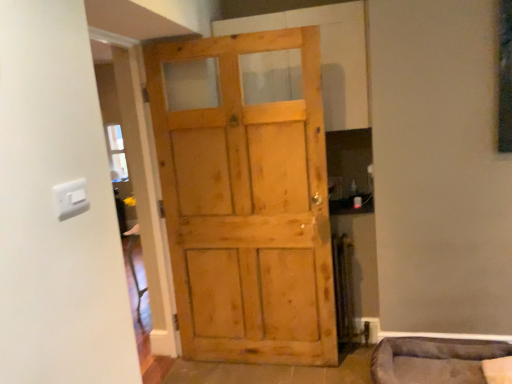
What do you see at coordinates (246, 206) in the screenshot? This screenshot has height=384, width=512. I see `light brown wooden door at center` at bounding box center [246, 206].

Locate an element on the screen. Image resolution: width=512 pixels, height=384 pixels. white plastic light switch at upper left is located at coordinates (71, 198).

In terms of width, does white plastic light switch at upper left look wider or thinner when compared to velvet grey pet bed at lower right?

Clearly, white plastic light switch at upper left has less width compared to velvet grey pet bed at lower right.

From a real-world perspective, relative to velvet grey pet bed at lower right, is white plastic light switch at upper left vertically above or below?

white plastic light switch at upper left is above velvet grey pet bed at lower right.

Considering their positions, is white plastic light switch at upper left located in front of or behind velvet grey pet bed at lower right?

white plastic light switch at upper left is in front of velvet grey pet bed at lower right.

Does velvet grey pet bed at lower right have a lesser width compared to light brown wooden door at center?

No, velvet grey pet bed at lower right is not thinner than light brown wooden door at center.

Considering the sizes of objects velvet grey pet bed at lower right and light brown wooden door at center in the image provided, who is shorter, velvet grey pet bed at lower right or light brown wooden door at center?

Standing shorter between the two is velvet grey pet bed at lower right.

From the image's perspective, would you say velvet grey pet bed at lower right is shown under light brown wooden door at center?

Indeed, from the image's perspective, velvet grey pet bed at lower right is shown beneath light brown wooden door at center.

Choose the correct answer: Is velvet grey pet bed at lower right inside light brown wooden door at center or outside it?

velvet grey pet bed at lower right cannot be found inside light brown wooden door at center.

Is white plastic light switch at upper left facing away from light brown wooden door at center?

No, white plastic light switch at upper left is not facing away from light brown wooden door at center.

Does white plastic light switch at upper left appear on the left side of light brown wooden door at center?

Yes, white plastic light switch at upper left is to the left of light brown wooden door at center.

From the image's perspective, who appears lower, white plastic light switch at upper left or light brown wooden door at center?

light brown wooden door at center.

Considering the relative sizes of white plastic light switch at upper left and light brown wooden door at center in the image provided, is white plastic light switch at upper left taller than light brown wooden door at center?

Incorrect, the height of white plastic light switch at upper left is not larger of that of light brown wooden door at center.

Is light brown wooden door at center taller than velvet grey pet bed at lower right?

Correct, light brown wooden door at center is much taller as velvet grey pet bed at lower right.

From a real-world perspective, is light brown wooden door at center located higher than velvet grey pet bed at lower right?

Yes, from a real-world perspective, light brown wooden door at center is on top of velvet grey pet bed at lower right.

Is light brown wooden door at center inside or outside of velvet grey pet bed at lower right?

light brown wooden door at center exists outside the volume of velvet grey pet bed at lower right.

Is light brown wooden door at center at the right side of velvet grey pet bed at lower right?

No.

Is light brown wooden door at center facing towards white plastic light switch at upper left?

Yes, light brown wooden door at center faces towards white plastic light switch at upper left.

Is point (329, 361) farther from camera compared to point (67, 211)?

Yes, it is behind point (67, 211).

From the image's perspective, which is above, light brown wooden door at center or white plastic light switch at upper left?

From the image's view, white plastic light switch at upper left is above.

In the scene shown: Considering the sizes of objects light brown wooden door at center and white plastic light switch at upper left in the image provided, who is taller, light brown wooden door at center or white plastic light switch at upper left?

Standing taller between the two is light brown wooden door at center.

Considering the relative sizes of velvet grey pet bed at lower right and white plastic light switch at upper left in the image provided, is velvet grey pet bed at lower right smaller than white plastic light switch at upper left?

No, velvet grey pet bed at lower right is not smaller than white plastic light switch at upper left.

In the scene shown: Looking at their sizes, would you say velvet grey pet bed at lower right is wider or thinner than white plastic light switch at upper left?

Clearly, velvet grey pet bed at lower right has more width compared to white plastic light switch at upper left.

Is velvet grey pet bed at lower right positioned far away from white plastic light switch at upper left?

Yes, velvet grey pet bed at lower right is far from white plastic light switch at upper left.

Does velvet grey pet bed at lower right have a lesser height compared to white plastic light switch at upper left?

Incorrect, the height of velvet grey pet bed at lower right does not fall short of that of white plastic light switch at upper left.

Find the location of a particular element. The image size is (512, 384). furniture that is under the white plastic light switch at upper left (from a real-world perspective) is located at coordinates (433, 360).

In order to click on furniture on the right of light brown wooden door at center in this screenshot , I will do `click(433, 360)`.

Based on their spatial positions, is light brown wooden door at center or white plastic light switch at upper left further from velvet grey pet bed at lower right?

Among the two, white plastic light switch at upper left is located further to velvet grey pet bed at lower right.

Estimate the real-world distances between objects in this image. Which object is further from white plastic light switch at upper left, velvet grey pet bed at lower right or light brown wooden door at center?

velvet grey pet bed at lower right lies further to white plastic light switch at upper left than the other object.

Considering their positions, is white plastic light switch at upper left positioned further to light brown wooden door at center than velvet grey pet bed at lower right?

Based on the image, white plastic light switch at upper left appears to be further to light brown wooden door at center.

Looking at the image, which one is located closer to light brown wooden door at center, velvet grey pet bed at lower right or white plastic light switch at upper left?

velvet grey pet bed at lower right is closer to light brown wooden door at center.

Estimate the real-world distances between objects in this image. Which object is further from white plastic light switch at upper left, light brown wooden door at center or velvet grey pet bed at lower right?

Among the two, velvet grey pet bed at lower right is located further to white plastic light switch at upper left.

Based on their spatial positions, is white plastic light switch at upper left or light brown wooden door at center further from velvet grey pet bed at lower right?

The object further to velvet grey pet bed at lower right is white plastic light switch at upper left.

The width and height of the screenshot is (512, 384). Identify the location of door between white plastic light switch at upper left and velvet grey pet bed at lower right from left to right. (246, 206).